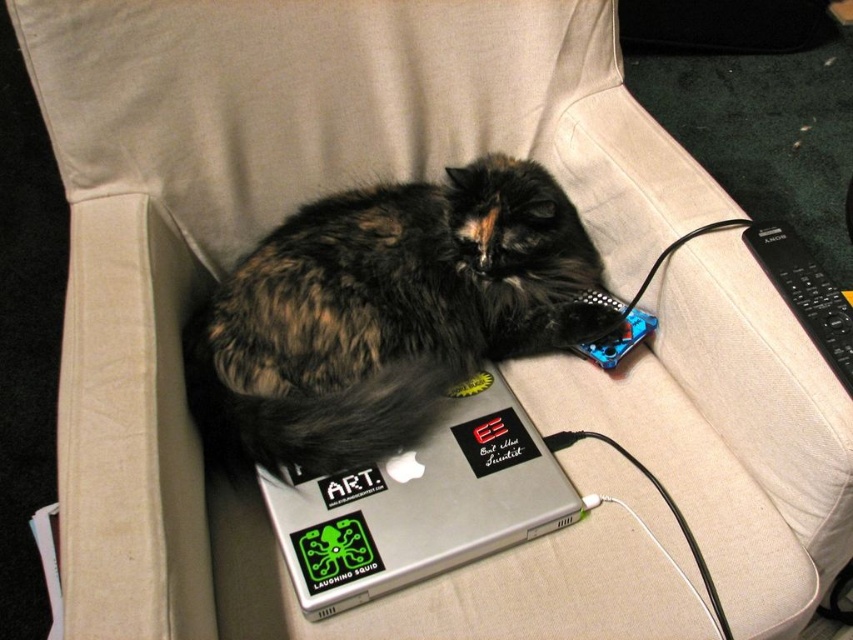
Which is above, fluffy fur cat at center or silver metallic laptop at center?

fluffy fur cat at center

Can you confirm if fluffy fur cat at center is smaller than silver metallic laptop at center?

Incorrect, fluffy fur cat at center is not smaller in size than silver metallic laptop at center.

Is point (456, 266) farther from camera compared to point (352, 490)?

Yes, it is behind point (352, 490).

Identify the location of fluffy fur cat at center. (386, 314).

Which is more to the right, silver metallic laptop at center or black plastic remote at right?

From the viewer's perspective, black plastic remote at right appears more on the right side.

Who is shorter, silver metallic laptop at center or black plastic remote at right?

With less height is black plastic remote at right.

Who is more forward, (376,529) or (784,292)?

Point (376,529) is in front.

You are a GUI agent. You are given a task and a screenshot of the screen. Output one action in this format:
    pyautogui.click(x=<x>, y=<y>)
    Task: Click on the silver metallic laptop at center
    This screenshot has width=853, height=640.
    Given the screenshot: What is the action you would take?
    pyautogui.click(x=421, y=502)

Does fluffy fur cat at center come behind black plastic remote at right?

Yes, it is behind black plastic remote at right.

Can you confirm if fluffy fur cat at center is shorter than black plastic remote at right?

In fact, fluffy fur cat at center may be taller than black plastic remote at right.

Is point (485, 256) less distant than point (828, 301)?

No, it is not.

Find the location of a particular element. Image resolution: width=853 pixels, height=640 pixels. fluffy fur cat at center is located at coordinates (386, 314).